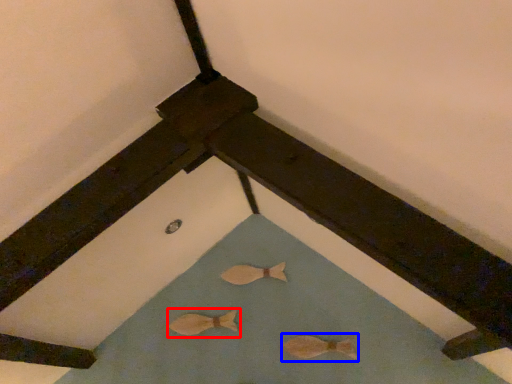
Question: Which point is further to the camera, animal (highlighted by a red box) or animal (highlighted by a blue box)?

Choices:
 (A) animal
 (B) animal

Answer: (A)